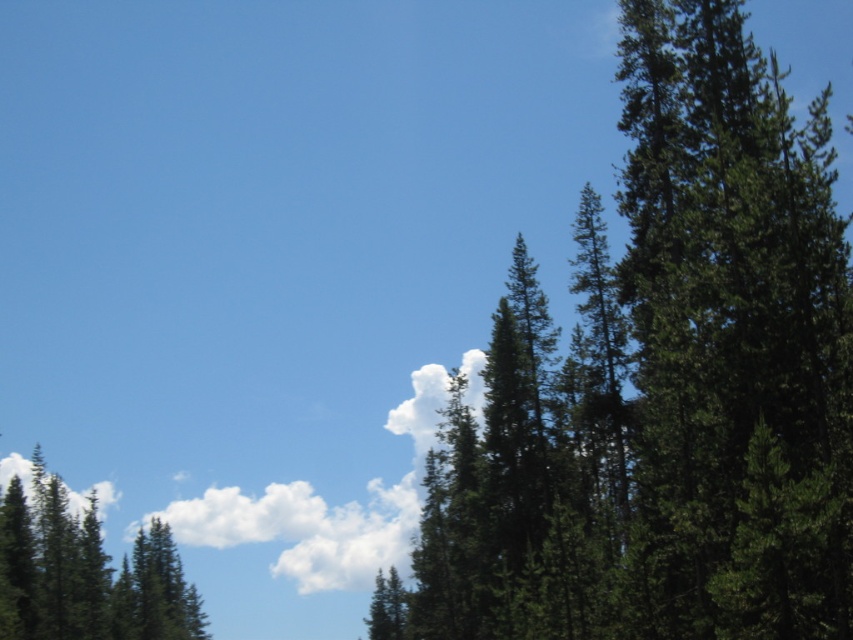
Between green textured pine trees at upper right and green matte tree at lower left, which one has less height?

With less height is green matte tree at lower left.

Which is behind, point (744, 20) or point (21, 580)?

Point (744, 20)

Locate an element on the screen. This screenshot has height=640, width=853. green textured pine trees at upper right is located at coordinates (662, 385).